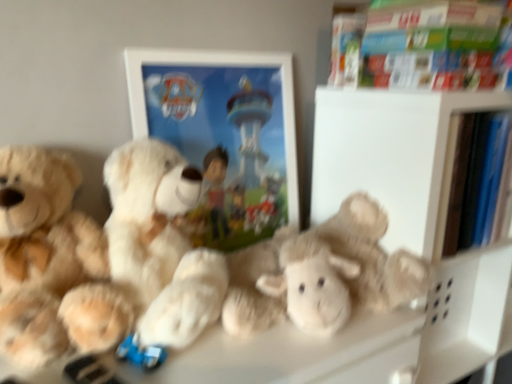
Where is `vacant point above white matte picture frame at center (from a real-world perspective)`? vacant point above white matte picture frame at center (from a real-world perspective) is located at coordinates (219, 44).